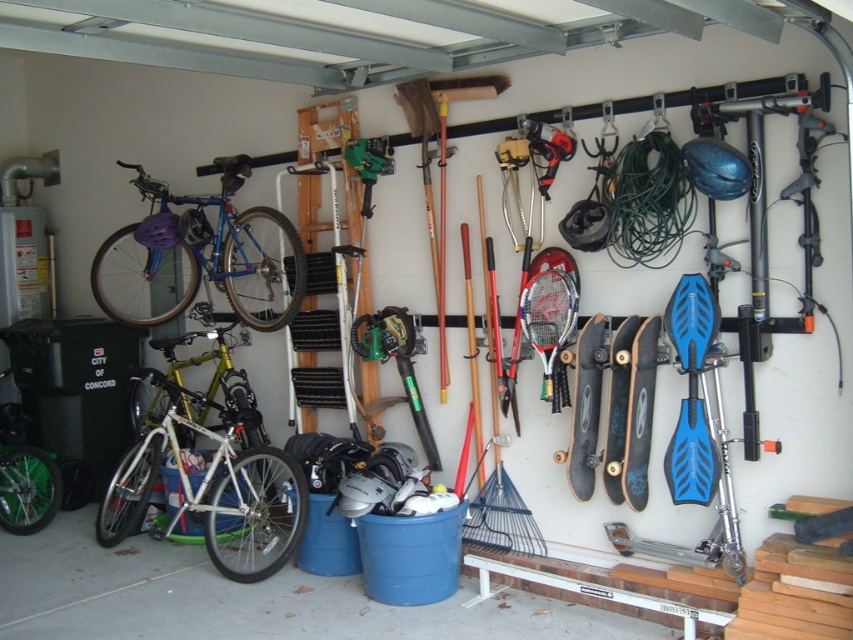
Based on the photo, you are standing in the garage and want to take a photo of the white matte bicycle at left from a distance. If your camera can focus up to 4 meters, will you be able to capture a clear photo?

The distance between the white matte bicycle at left and the camera is 4.18 meters, which exceeds the camera focus limit of 4 meters. Therefore, the camera cannot capture a clear photo of the white matte bicycle at left.

You are organizing the garage and want to move the white matte bicycle at left closer to the wall. However, there is an obstacle in the way. Which object might be blocking your path to the green plastic chainsaw at center?

The white matte bicycle at left is in front of the green plastic chainsaw at center, so it might be blocking the path.